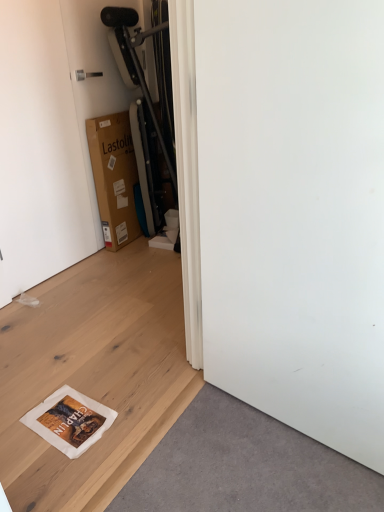
Question: Which is correct: white matte plywood at lower left is inside white matte door at upper left, or outside of it?

Choices:
 (A) inside
 (B) outside

Answer: (B)

Question: From a real-world perspective, is white matte plywood at lower left physically located above or below white matte door at upper left?

Choices:
 (A) below
 (B) above

Answer: (A)

Question: Based on their relative distances, which object is nearer to the white matte door at upper left?

Choices:
 (A) white matte plywood at lower left
 (B) white matte screen door at lower right
 (C) brown cardboard box at upper left

Answer: (C)

Question: Estimate the real-world distances between objects in this image. Which object is closer to the white matte screen door at lower right?

Choices:
 (A) white matte door at upper left
 (B) brown cardboard box at upper left
 (C) white matte plywood at lower left

Answer: (C)